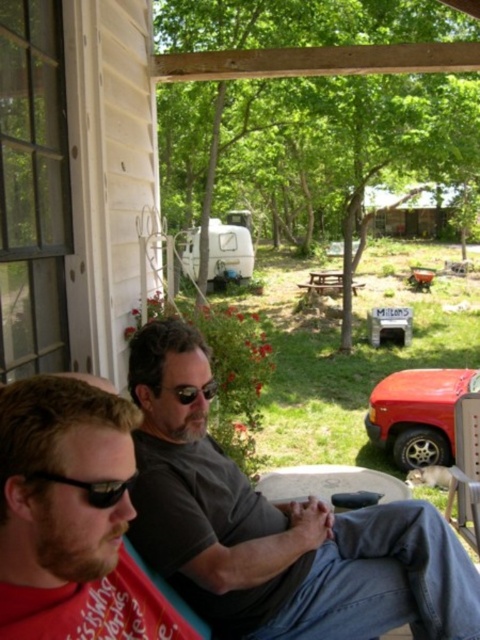
Question: Based on their relative distances, which object is farther from the black plastic sunglasses at lower left?

Choices:
 (A) black reflective sunglasses at center
 (B) gray matte shirt at center

Answer: (B)

Question: In this image, where is black plastic sunglasses at lower left located relative to black reflective sunglasses at center?

Choices:
 (A) above
 (B) below

Answer: (B)

Question: Observing the image, what is the correct spatial positioning of gray matte shirt at center in reference to black plastic sunglasses at lower left?

Choices:
 (A) below
 (B) above

Answer: (A)

Question: Estimate the real-world distances between objects in this image. Which object is farther from the black reflective sunglasses at center?

Choices:
 (A) gray matte shirt at center
 (B) black plastic sunglasses at lower left

Answer: (B)

Question: Does gray matte shirt at center have a larger size compared to black reflective sunglasses at center?

Choices:
 (A) yes
 (B) no

Answer: (A)

Question: Estimate the real-world distances between objects in this image. Which object is farther from the gray matte shirt at center?

Choices:
 (A) black plastic sunglasses at lower left
 (B) black reflective sunglasses at center

Answer: (A)